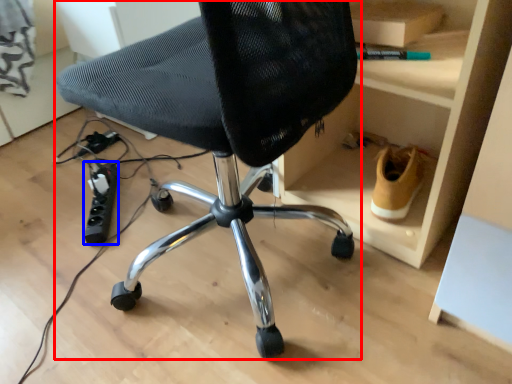
Question: Which object appears farthest to the camera in this image, chair (highlighted by a red box) or plug (highlighted by a blue box)?

Choices:
 (A) chair
 (B) plug

Answer: (B)